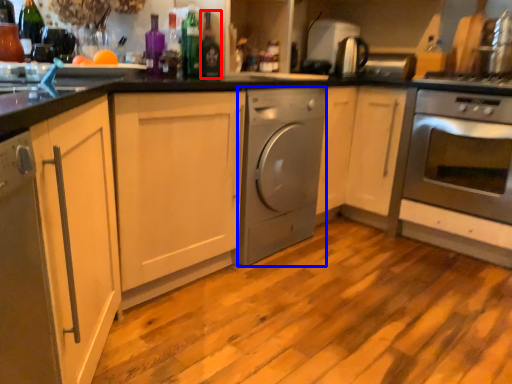
Question: Which of the following is the farthest to the observer, bottle (highlighted by a red box) or home appliance (highlighted by a blue box)?

Choices:
 (A) bottle
 (B) home appliance

Answer: (B)